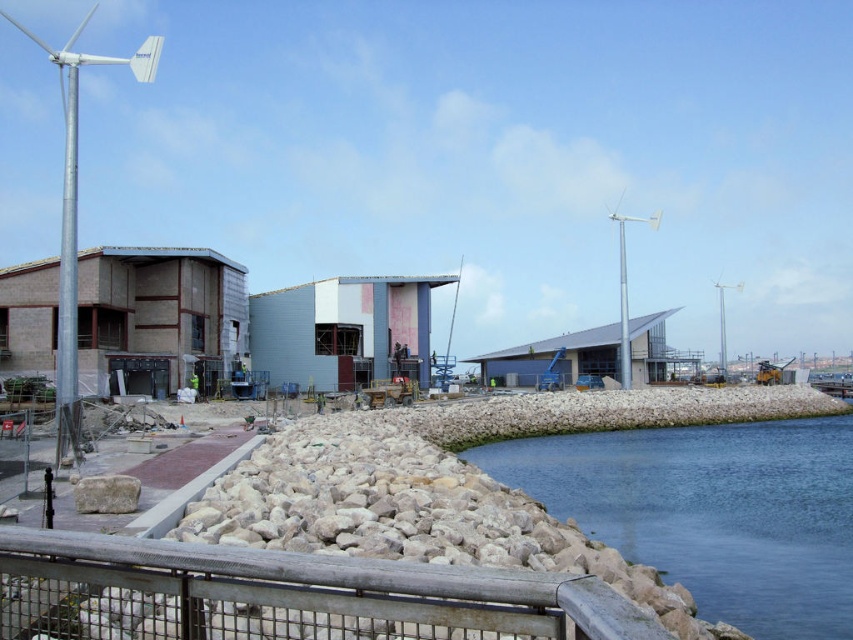
You are a construction worker standing on the walkway and need to move from the silver metallic wind turbine at left to the rustic wood rail at lower center. Which direction should you move to reach it?

The rustic wood rail at lower center is positioned on the right side of silver metallic wind turbine at left, so you should move to the right to reach it.

You are standing at the point marked by the coordinates point (288, 595) in the construction site. What object is located exactly at your current position?

The object located at point (288, 595) is the rustic wood rail at lower center.

You are a crane operator on the construction site. You need to lower a heavy beam to the blue smooth water at lower right without hitting the silver metallic wind turbine at left. Can you safely lower the beam directly to the water?

The blue smooth water at lower right is shorter than the silver metallic wind turbine at left, so yes, you can safely lower the beam directly to the blue smooth water at lower right without hitting the turbine.